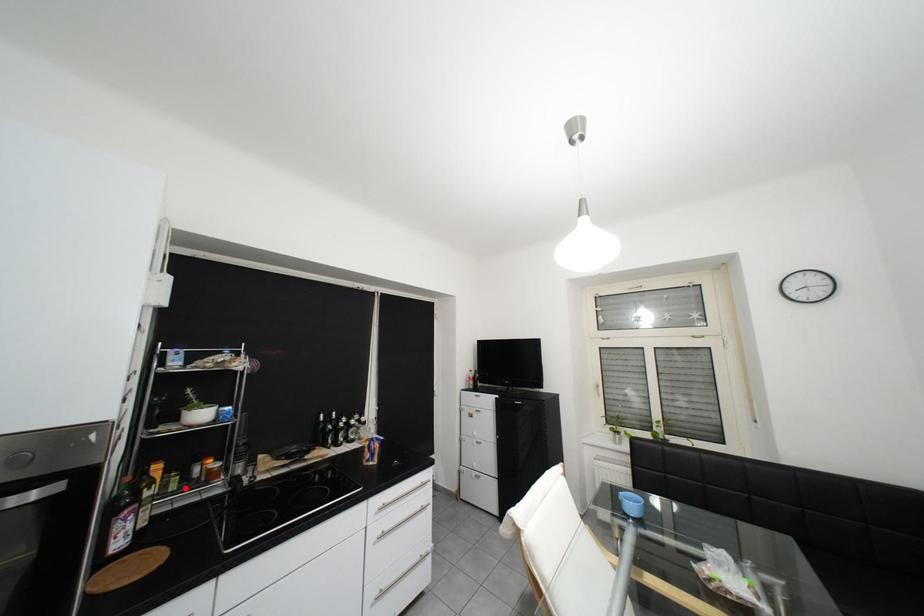
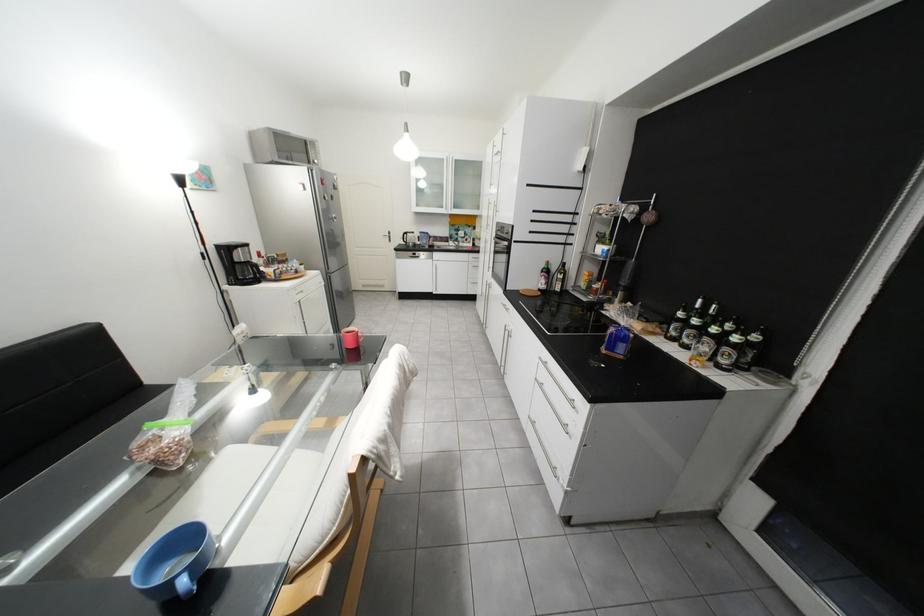
Where in the second image is the point corresponding to the highlighted location from the first image?

(596, 288)